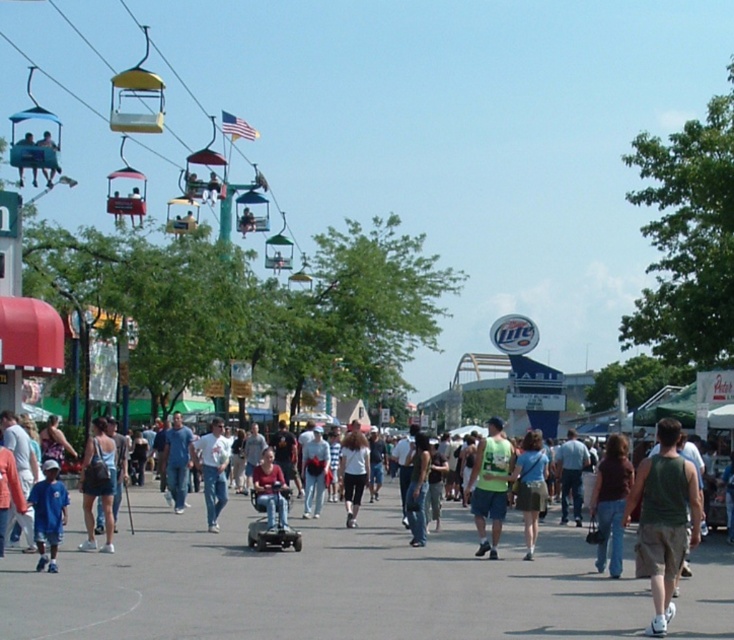
Does point (163, 563) lie in front of point (95, 444)?

Yes.

Does jeans at center have a lesser width compared to denim shorts at center?

Incorrect, jeans at center's width is not less than denim shorts at center's.

Image resolution: width=734 pixels, height=640 pixels. I want to click on jeans at center, so click(319, 582).

The height and width of the screenshot is (640, 734). What do you see at coordinates (664, 518) in the screenshot?
I see `green sleeveless shirt at center` at bounding box center [664, 518].

Which of these two, green sleeveless shirt at center or denim shorts at center, stands shorter?

denim shorts at center is shorter.

Between point (664, 554) and point (98, 440), which one is positioned behind?

The point (98, 440) is behind.

The height and width of the screenshot is (640, 734). I want to click on green sleeveless shirt at center, so click(664, 518).

Is green sleeveless shirt at center wider than denim jeans at center?

Correct, the width of green sleeveless shirt at center exceeds that of denim jeans at center.

Does green sleeveless shirt at center have a smaller size compared to denim jeans at center?

Incorrect, green sleeveless shirt at center is not smaller in size than denim jeans at center.

Does point (672, 582) come in front of point (606, 449)?

Yes, point (672, 582) is in front of point (606, 449).

Identify the location of green sleeveless shirt at center. (664, 518).